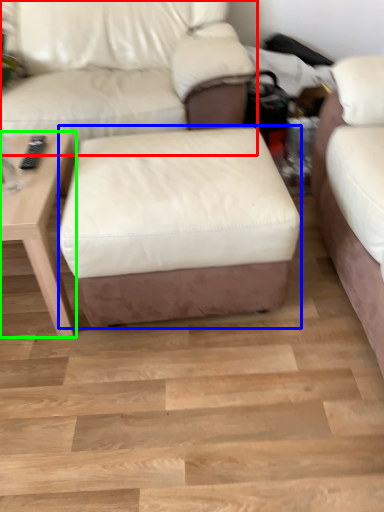
Question: Which object is the farthest from studio couch (highlighted by a red box)? Choose among these: stool (highlighted by a blue box) or table (highlighted by a green box).

Choices:
 (A) stool
 (B) table

Answer: (A)